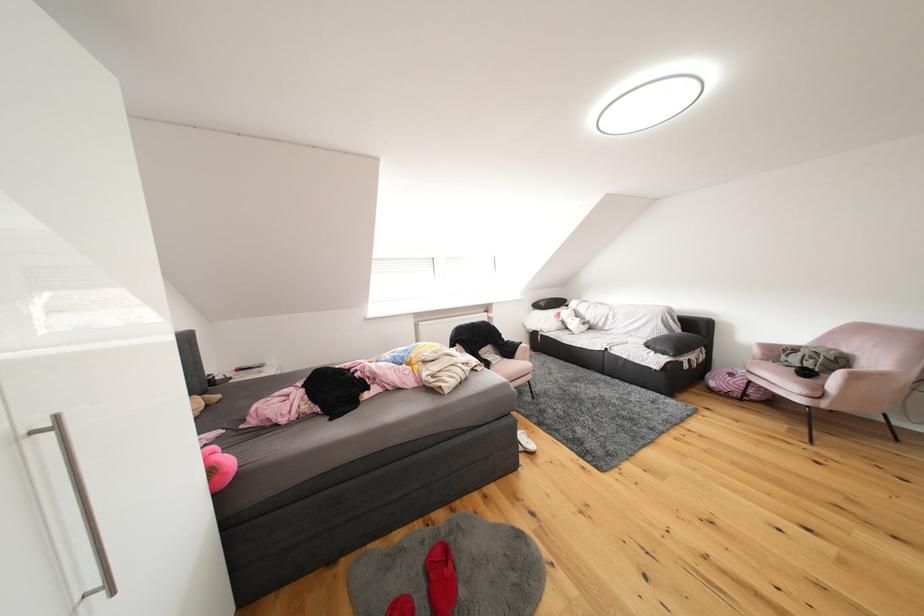
This screenshot has width=924, height=616. Find the location of `silver cabinet handle`. silver cabinet handle is located at coordinates (83, 507).